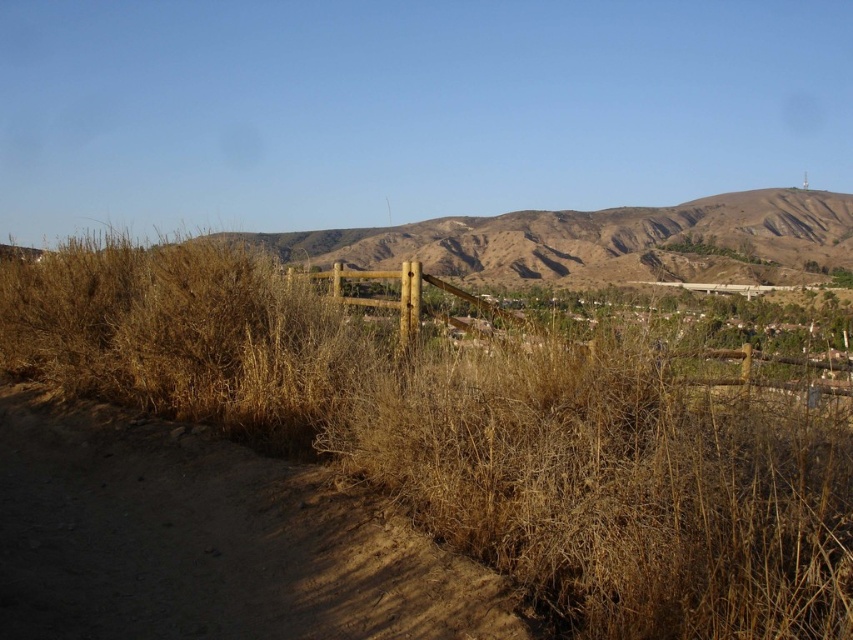
Question: Which is nearer to the brown dirt track at lower left?

Choices:
 (A) dry straw at center
 (B) brown wooden fence at center

Answer: (A)

Question: Is dry straw at center positioned behind brown wooden fence at center?

Choices:
 (A) yes
 (B) no

Answer: (B)

Question: Is dry straw at center thinner than brown dirt track at lower left?

Choices:
 (A) yes
 (B) no

Answer: (B)

Question: Can you confirm if brown dirt track at lower left is positioned to the left of brown wooden fence at center?

Choices:
 (A) yes
 (B) no

Answer: (A)

Question: Among these points, which one is nearest to the camera?

Choices:
 (A) (456, 349)
 (B) (519, 321)

Answer: (A)

Question: Which is nearer to the dry straw at center?

Choices:
 (A) brown dirt track at lower left
 (B) brown wooden fence at center

Answer: (A)